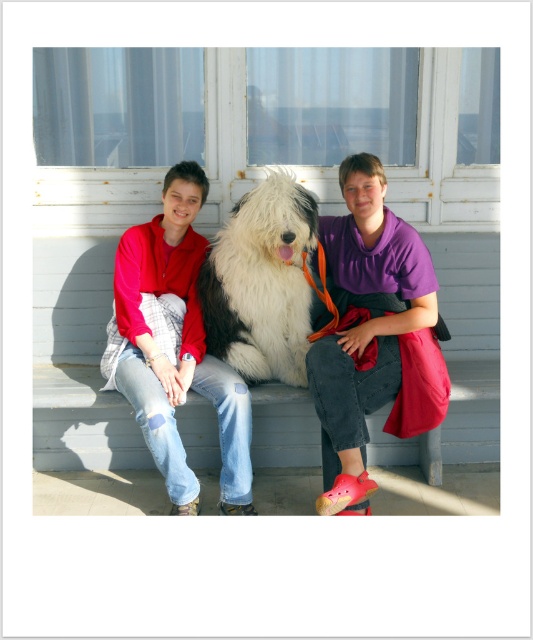
Is point (354, 193) positioned before point (159, 300)?

Yes, point (354, 193) is in front of point (159, 300).

Between point (356, 435) and point (151, 221), which one is positioned behind?

The point (151, 221) is behind.

Where is `purple cotton shirt at center`? The width and height of the screenshot is (533, 640). purple cotton shirt at center is located at coordinates (374, 336).

Does fluffy fur dog at center have a greater width compared to fluffy white dog at center?

Yes.

Measure the distance between fluffy fur dog at center and camera.

fluffy fur dog at center and camera are 10.59 feet apart.

The height and width of the screenshot is (640, 533). I want to click on fluffy fur dog at center, so click(373, 336).

Is fluffy fur dog at center behind matte red jacket at left?

No, it is in front of matte red jacket at left.

Is fluffy fur dog at center positioned in front of matte red jacket at left?

Yes, it is.

This screenshot has height=640, width=533. What do you see at coordinates (373, 336) in the screenshot? I see `fluffy fur dog at center` at bounding box center [373, 336].

You are a GUI agent. You are given a task and a screenshot of the screen. Output one action in this format:
    pyautogui.click(x=<x>, y=<y>)
    Task: Click on the fluffy fur dog at center
    
    Given the screenshot: What is the action you would take?
    pyautogui.click(x=373, y=336)